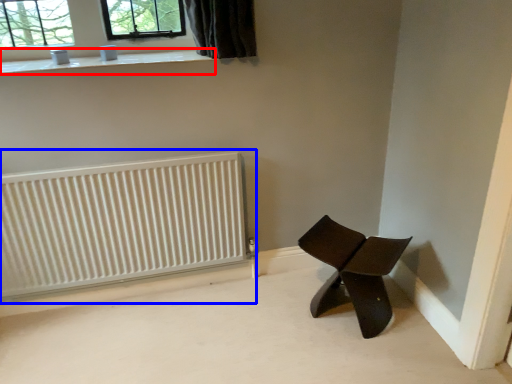
Question: Which point is closer to the camera, window sill (highlighted by a red box) or radiator (highlighted by a blue box)?

Choices:
 (A) window sill
 (B) radiator

Answer: (A)